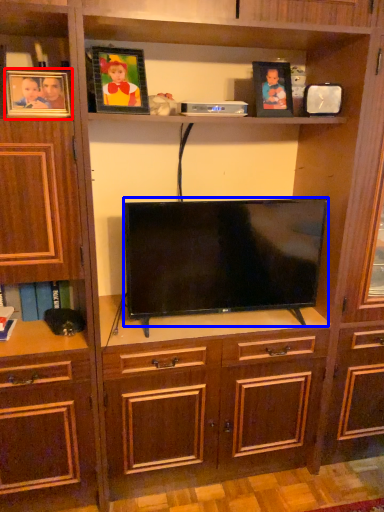
Question: Which object is further to the camera taking this photo, picture frame (highlighted by a red box) or television (highlighted by a blue box)?

Choices:
 (A) picture frame
 (B) television

Answer: (B)